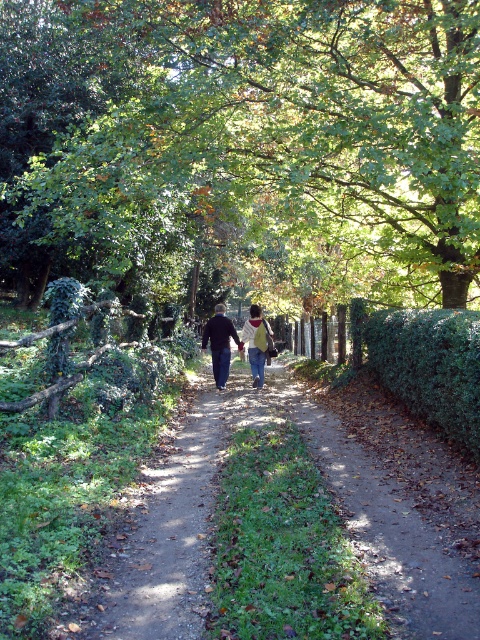
Is point (463, 349) positioned behind point (215, 344)?

No.

Is green leafy hedge at right positioned at the back of denim jacket at center?

No, it is in front of denim jacket at center.

Measure the distance between green leafy hedge at right and camera.

26.58 feet

This screenshot has width=480, height=640. Find the location of `green leafy hedge at right`. green leafy hedge at right is located at coordinates (431, 365).

Can you confirm if green leafy tree at center is positioned to the left of yellow fabric backpack at center?

Indeed, green leafy tree at center is positioned on the left side of yellow fabric backpack at center.

Is green leafy tree at center to the right of yellow fabric backpack at center from the viewer's perspective?

No, green leafy tree at center is not to the right of yellow fabric backpack at center.

The height and width of the screenshot is (640, 480). Describe the element at coordinates (242, 147) in the screenshot. I see `green leafy tree at center` at that location.

Where is `green leafy tree at center`? green leafy tree at center is located at coordinates (242, 147).

Does green leafy hedge at right appear under yellow fabric backpack at center?

Yes, green leafy hedge at right is below yellow fabric backpack at center.

Who is more forward, (443, 346) or (245, 340)?

Point (443, 346)

Where is `green leafy hedge at right`? This screenshot has width=480, height=640. green leafy hedge at right is located at coordinates (431, 365).